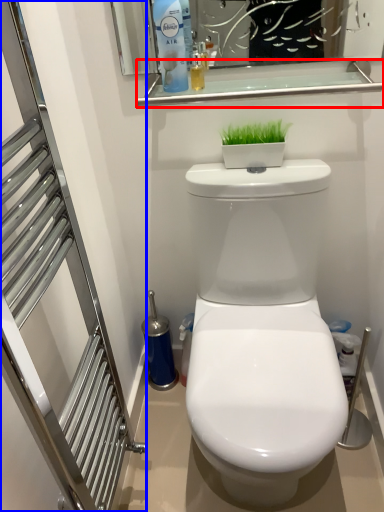
Question: Which point is closer to the camera, balustrade (highlighted by a red box) or screen door (highlighted by a blue box)?

Choices:
 (A) balustrade
 (B) screen door

Answer: (B)